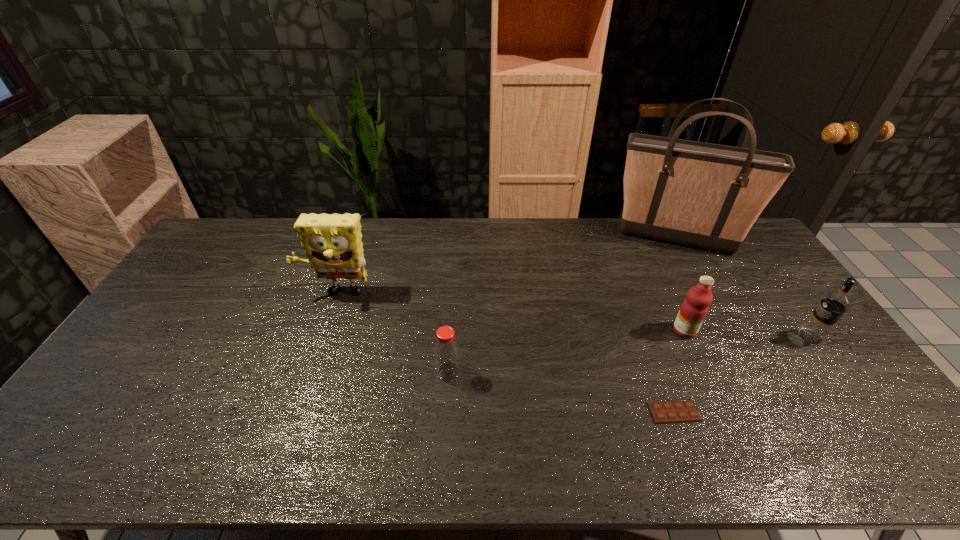
Locate an element on the screen. free space between the shopping bag and the vodka is located at coordinates (743, 288).

This screenshot has width=960, height=540. I want to click on vacant space in between the nearest object and the sponge, so click(x=505, y=353).

The height and width of the screenshot is (540, 960). I want to click on free spot between the fifth tallest object and the farthest object, so click(x=562, y=305).

The height and width of the screenshot is (540, 960). What are the coordinates of `free point between the fruit juice and the farthest object` in the screenshot? It's located at (680, 285).

Locate an element on the screen. The width and height of the screenshot is (960, 540). free space between the vodka and the fruit juice is located at coordinates (748, 334).

Locate an element on the screen. This screenshot has width=960, height=540. empty space that is in between the bottle and the shortest object is located at coordinates (561, 392).

Find the location of a particular element. empty space that is in between the second shortest object and the nearest object is located at coordinates (561, 392).

Identify the location of object that is the second closest one to the farthest object. (835, 303).

Locate which object ranks third in proximity to the vodka. Please provide its 2D coordinates. Your answer should be formatted as a tuple, i.e. [(x, y)], where the tuple contains the x and y coordinates of a point satisfying the conditions above.

[(670, 412)]

Where is `free space that satisfies the following two spatial constraints: 1. on the face of the chocolate bar; 2. on the right side of the fifth shortest object`? The width and height of the screenshot is (960, 540). free space that satisfies the following two spatial constraints: 1. on the face of the chocolate bar; 2. on the right side of the fifth shortest object is located at coordinates (296, 412).